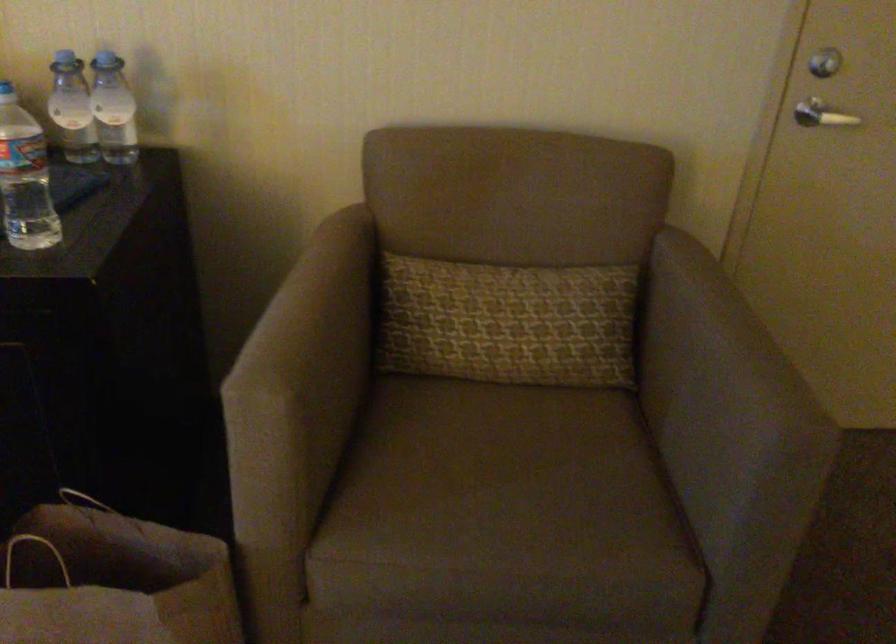
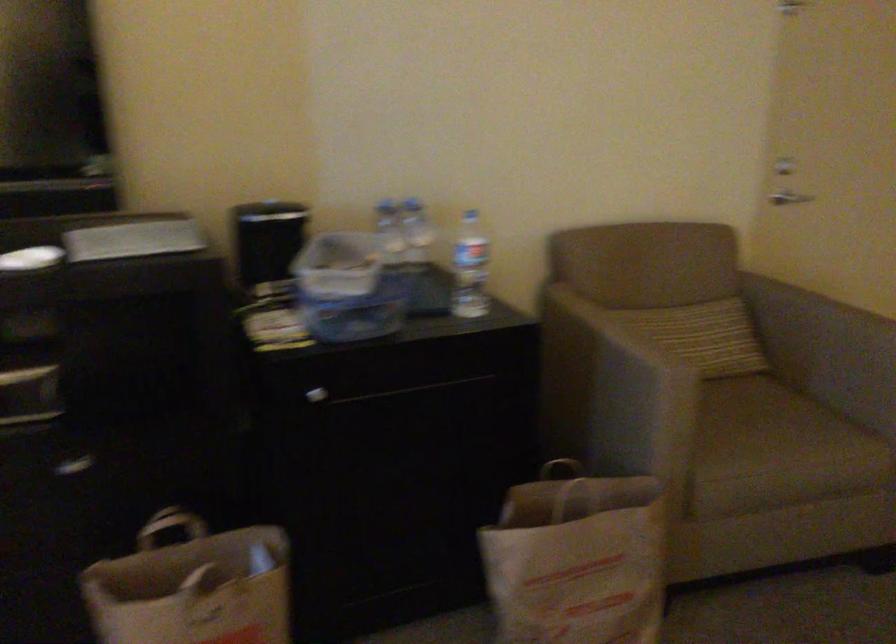
Where in the second image is the point corresponding to (x=524, y=476) from the first image?

(762, 418)